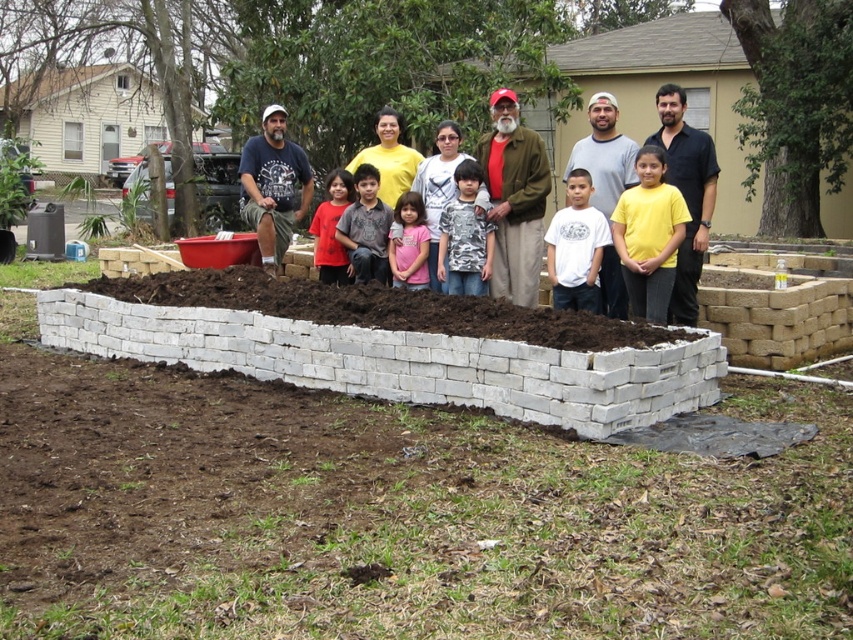
You are a photographer taking a group photo of the people standing behind the garden bed. You notice the white cotton shirt at center and the camouflage shirt at center. Which shirt is positioned lower in the photo?

The white cotton shirt at center is located below the camouflage shirt at center, so it is positioned lower in the photo.

You are a photographer taking a group photo of the people standing behind the garden bed. You want to ensure that the yellow matte shirt at center and the white cotton shirt at center are clearly visible in the photo. Given that the camera has a minimum focus distance of 15 inches, will both shirts be in focus?

The distance between the yellow matte shirt at center and the white cotton shirt at center is 16.08 inches, which exceeds the camera minimum focus distance of 15 inches. Therefore, both shirts will be in focus.